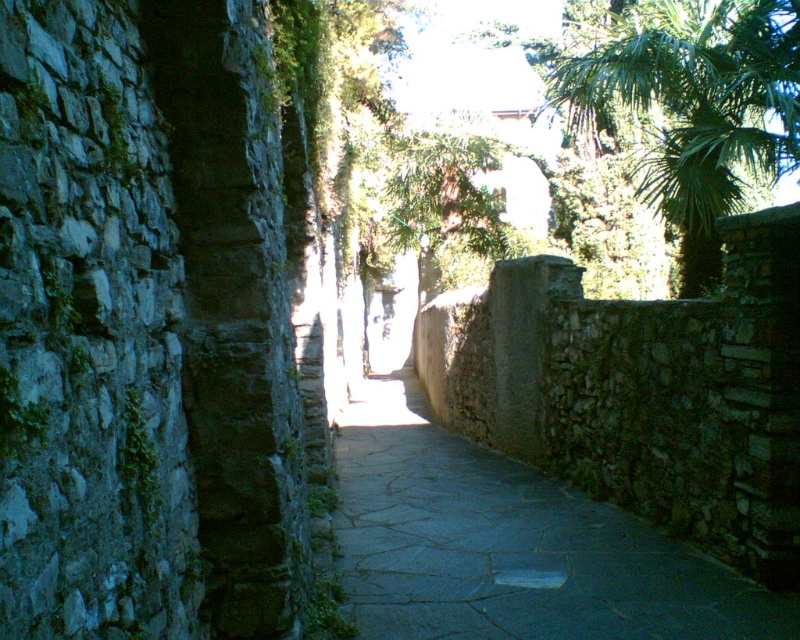
Question: Which point is farther to the camera?

Choices:
 (A) [x=676, y=577]
 (B) [x=702, y=72]

Answer: (B)

Question: Which point is farther from the camera taking this photo?

Choices:
 (A) (668, 570)
 (B) (694, 124)

Answer: (B)

Question: Is dark stone path at center further to camera compared to green leafy palm tree at upper right?

Choices:
 (A) no
 (B) yes

Answer: (A)

Question: Is dark stone path at center positioned behind green leafy palm tree at upper right?

Choices:
 (A) yes
 (B) no

Answer: (B)

Question: Is dark stone path at center above green leafy palm tree at upper right?

Choices:
 (A) yes
 (B) no

Answer: (B)